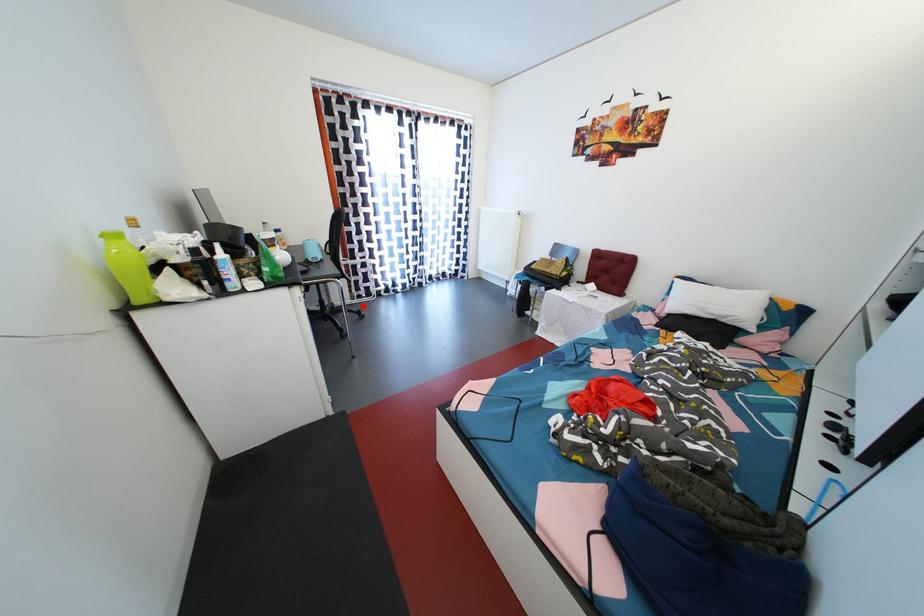
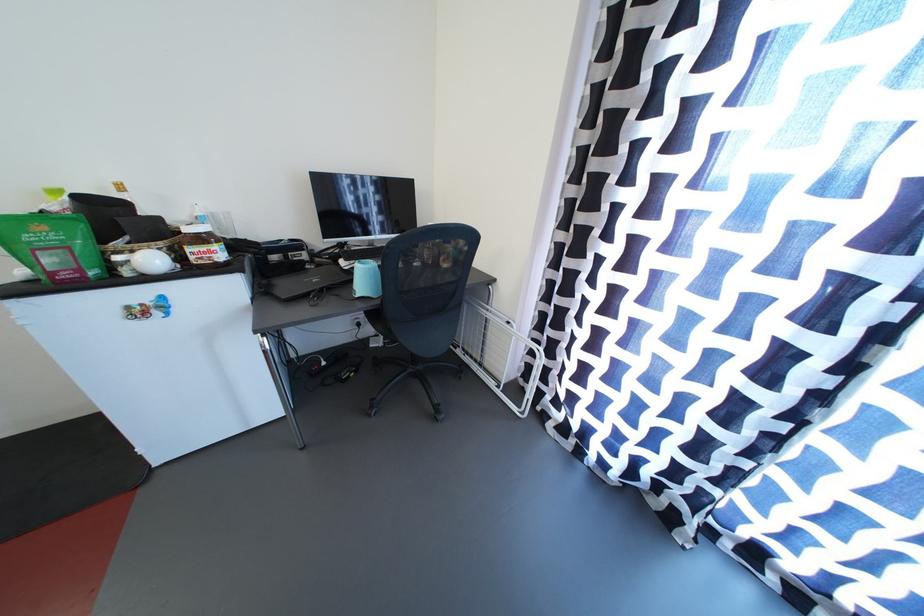
Question: I am providing you with two images of the same scene from different viewpoints. In image1, a red point is highlighted. Considering the same 3D point in image2, which of the following is correct?

Choices:
 (A) It is closer
 (B) It is farther

Answer: (B)